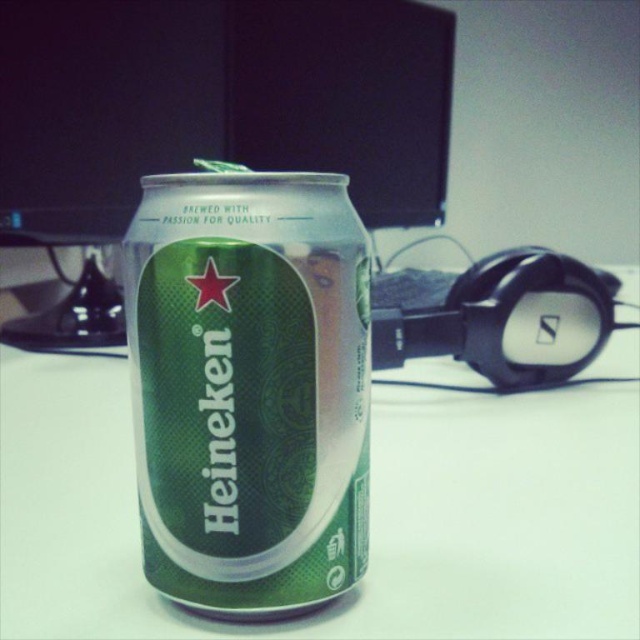
You are organizing a picnic basket and need to place the green metallic can at center and the green textured can at center next to each other. According to the image, which can should be placed on the right side?

The green metallic can at center should be placed on the right side since it is positioned to the right of the green textured can at center in the image.

You are organizing a picnic basket and have both the green metallic can at center and the green textured can at center. Which can takes up more vertical space in the basket?

The green textured can at center is taller than the green metallic can at center, so it takes up more vertical space in the basket.

You are standing in front of a computer desk with a Heineken beer can and a monitor. The can is at point (371, 515). If you want to place a new object at the same location as the green metallic can at center, where should you put it?

You should place the new object at point (371, 515), where the green metallic can at center is located.